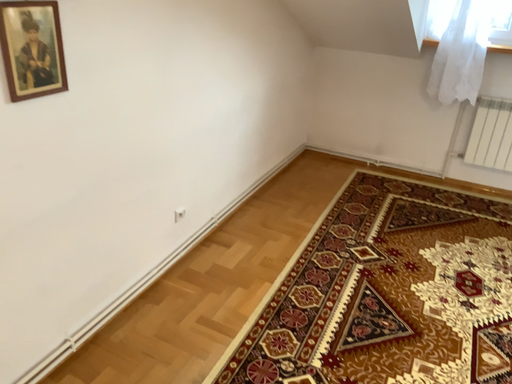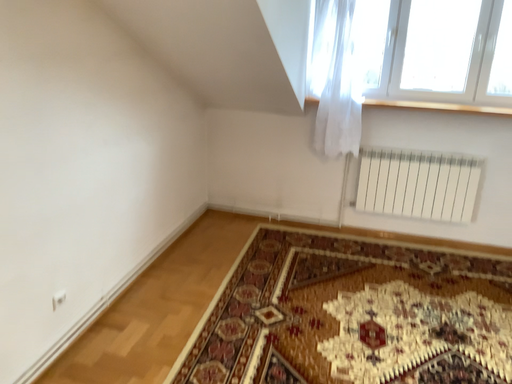
Question: Which way did the camera rotate in the video?

Choices:
 (A) rotated upward
 (B) rotated downward

Answer: (A)